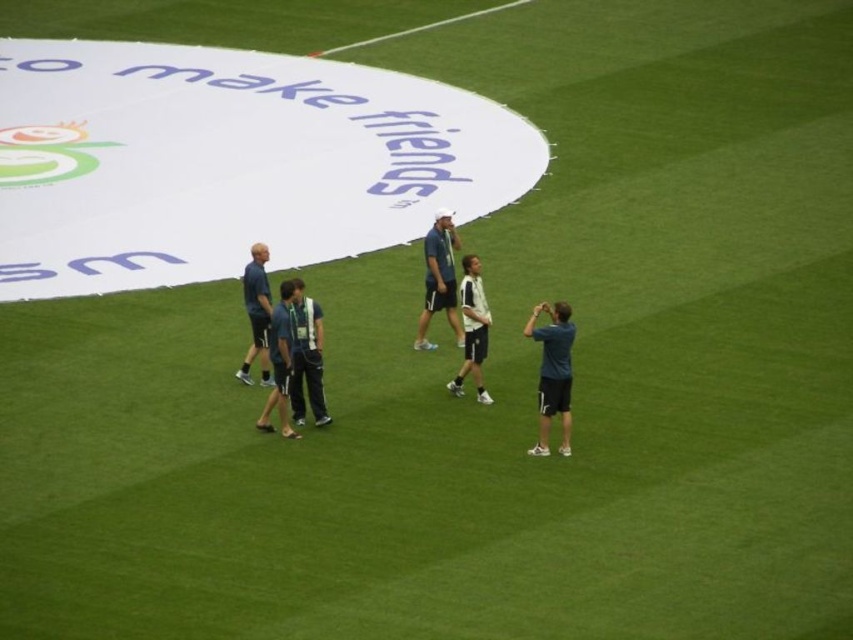
Can you confirm if light blue fabric shirt at center is thinner than white matte jacket at center?

No, light blue fabric shirt at center is not thinner than white matte jacket at center.

Does point (454, 324) come behind point (476, 390)?

Yes, it is.

Between point (438, 250) and point (476, 356), which one is positioned behind?

Point (438, 250)

I want to click on light blue fabric shirt at center, so click(x=439, y=280).

Which is behind, point (318, 314) or point (256, 342)?

Point (256, 342)

Does dark blue fabric at center appear on the right side of dark blue jersey at center?

Correct, you'll find dark blue fabric at center to the right of dark blue jersey at center.

Who is more distant from viewer, (315,326) or (259,280)?

The point (259,280) is behind.

You are a GUI agent. You are given a task and a screenshot of the screen. Output one action in this format:
    pyautogui.click(x=<x>, y=<y>)
    Task: Click on the dark blue fabric at center
    
    Given the screenshot: What is the action you would take?
    (306, 356)

Is dark blue fabric at center above dark blue fabric shirt at center?

No.

Is dark blue fabric at center further to camera compared to dark blue fabric shirt at center?

No, it is in front of dark blue fabric shirt at center.

Where is `dark blue fabric at center`? dark blue fabric at center is located at coordinates (306, 356).

The image size is (853, 640). I want to click on dark blue fabric at center, so click(306, 356).